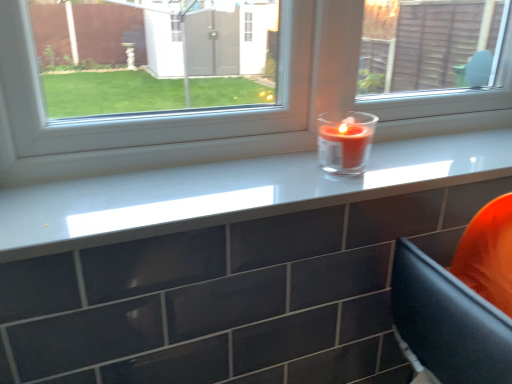
What are the coordinates of `free space to the right of translucent glass candle at center` in the screenshot? It's located at click(x=421, y=160).